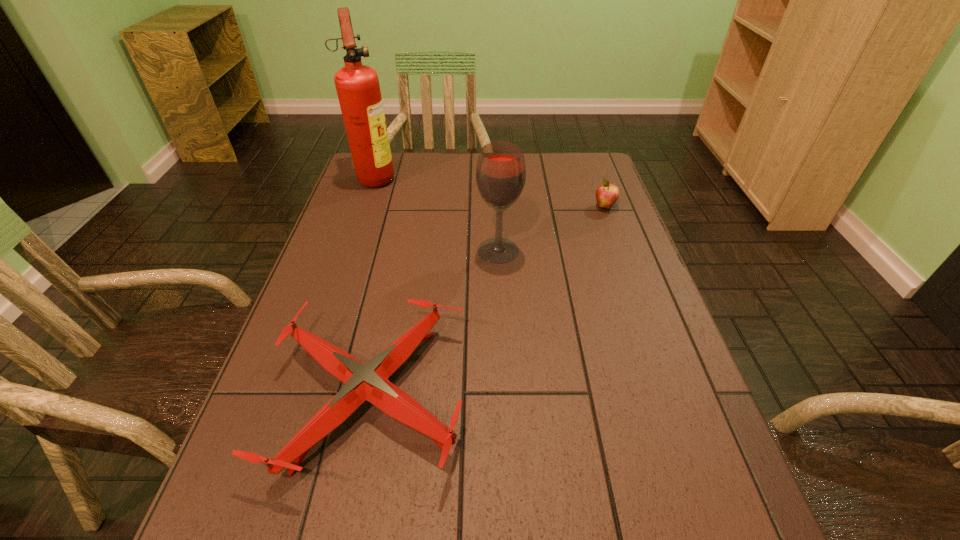
Find the location of a particular element. This screenshot has width=960, height=540. vacant space that satisfies the following two spatial constraints: 1. on the front-facing side of the drone; 2. on the right side of the farthest object is located at coordinates (303, 395).

I want to click on vacant region that satisfies the following two spatial constraints: 1. on the back side of the alcohol; 2. on the left side of the shortest object, so click(400, 250).

Locate an element on the screen. This screenshot has height=540, width=960. vacant point that satisfies the following two spatial constraints: 1. on the front-facing side of the tallest object; 2. on the right side of the drone is located at coordinates (303, 395).

Identify the location of vacant space that satisfies the following two spatial constraints: 1. on the front-facing side of the second object from right to left; 2. on the left side of the farthest object. (351, 250).

The height and width of the screenshot is (540, 960). I want to click on free space that satisfies the following two spatial constraints: 1. on the back side of the nearest object; 2. on the left side of the second tallest object, so click(x=400, y=250).

In order to click on free spot that satisfies the following two spatial constraints: 1. on the back side of the drone; 2. on the front-facing side of the tallest object in this screenshot , I will do point(416,177).

This screenshot has width=960, height=540. What are the coordinates of `free space that satisfies the following two spatial constraints: 1. on the front-facing side of the drone; 2. on the right side of the tallest object` in the screenshot? It's located at (303, 395).

Locate an element on the screen. This screenshot has height=540, width=960. free location that satisfies the following two spatial constraints: 1. on the front-facing side of the fire extinguisher; 2. on the back side of the second farthest object is located at coordinates pyautogui.click(x=366, y=207).

Locate an element on the screen. vacant position in the image that satisfies the following two spatial constraints: 1. on the back side of the second tallest object; 2. on the right side of the apple is located at coordinates (496, 207).

What are the coordinates of `free space that satisfies the following two spatial constraints: 1. on the back side of the nearest object; 2. on the left side of the apple` in the screenshot? It's located at (409, 207).